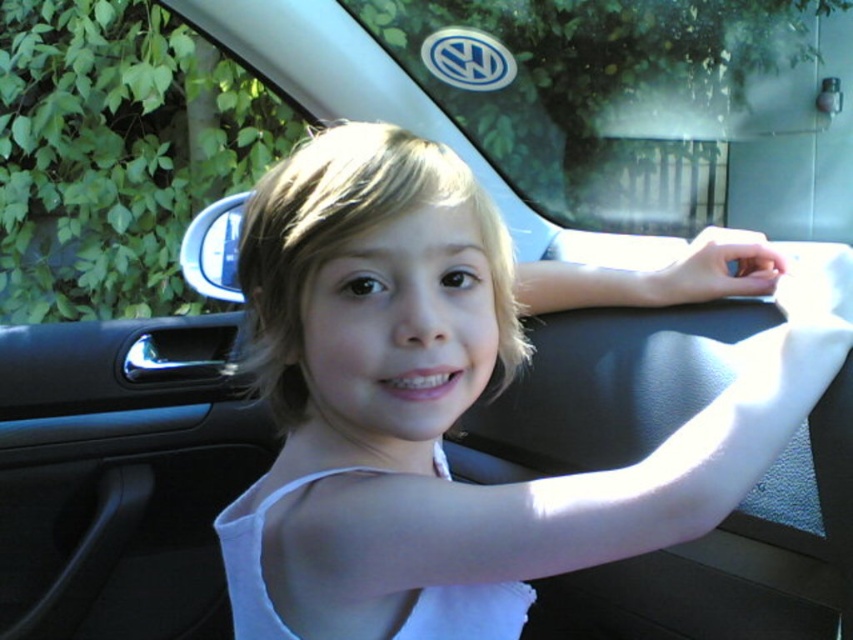
You are a parent trying to reach the white fabric at center in the car while sitting in the driver seat. Can you comfortably reach it without moving from your seat?

The white fabric at center and viewer are 19.25 inches apart from each other, so yes, you can comfortably reach it without moving from your seat since the distance is within a typical comfortable reach range.

You are a photographer trying to capture the child in the car. You notice the white fabric at center and the transparent glass window at upper left. Which object is closer to the child?

The white fabric at center is closer to the child because it is located below the transparent glass window at upper left, meaning it is positioned lower and nearer to the child.

You are a delivery person who needs to place a 5.5 feet long package in the car shown. The package must be placed between the white fabric at center and the transparent glass window at upper left. Can the package fit in that space?

The white fabric at center is 6.30 feet from the transparent glass window at upper left, so the 5.5 feet long package can fit between them since the distance is sufficient.